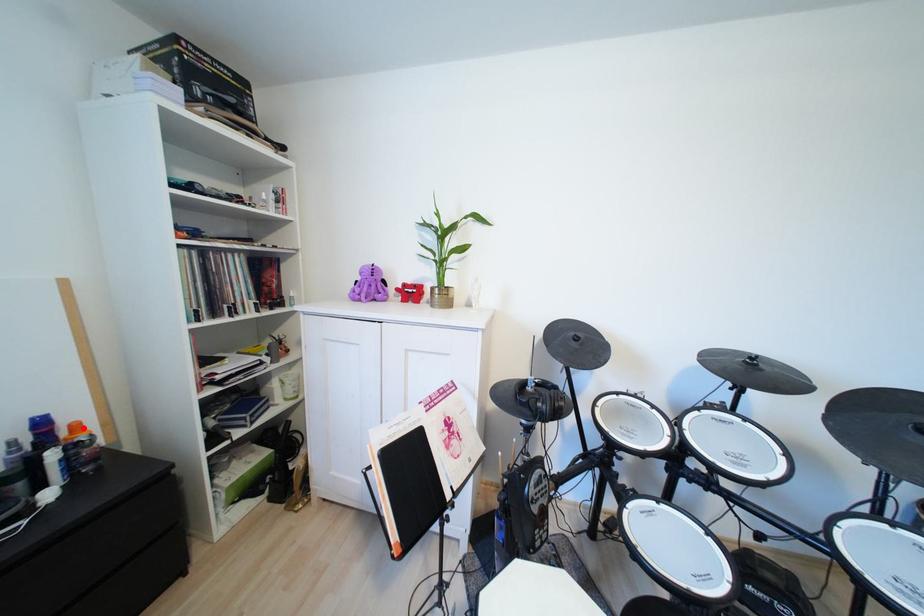
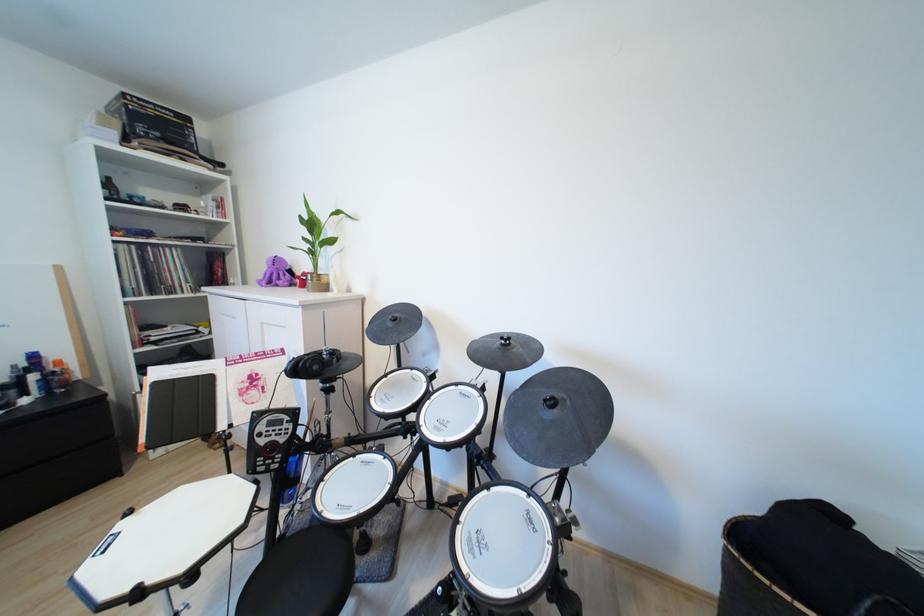
Locate, in the second image, the point that corresponds to the highlighted location in the first image.

(66, 363)